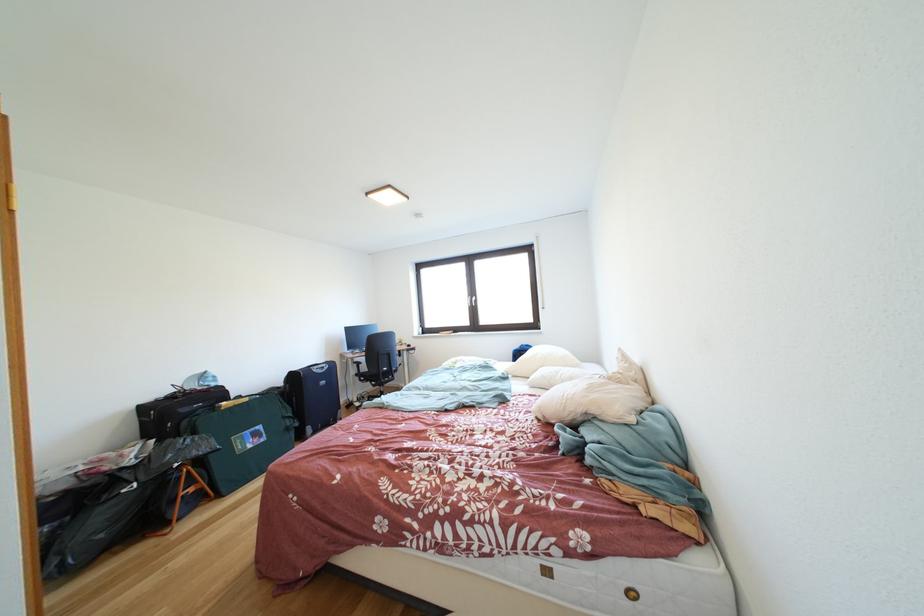
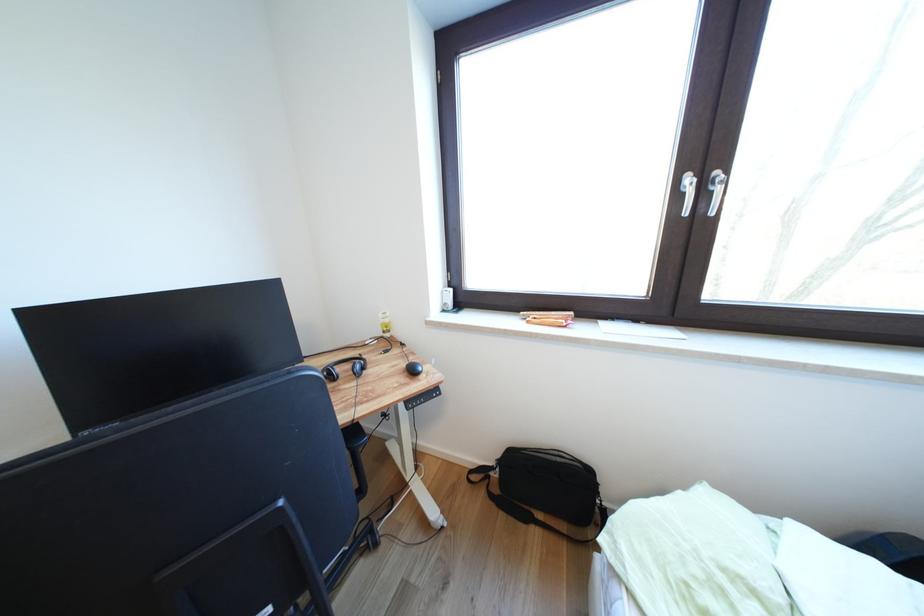
Question: Which direction would the cameraman need to move to produce the second image? Reply with the corresponding letter.

Choices:
 (A) Left
 (B) Right
 (C) Forward
 (D) Backward

Answer: (C)